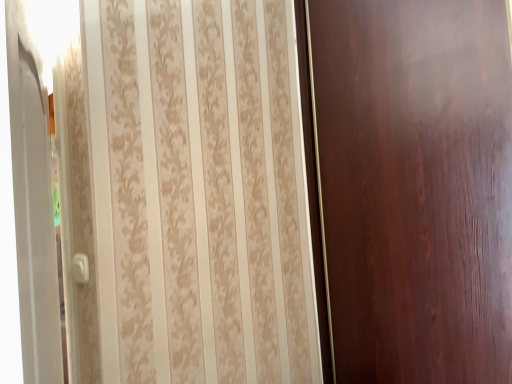
This screenshot has width=512, height=384. Find the location of `dark wood door at right`. dark wood door at right is located at coordinates (415, 187).

What do you see at coordinates (415, 187) in the screenshot?
I see `dark wood door at right` at bounding box center [415, 187].

The height and width of the screenshot is (384, 512). I want to click on dark wood door at right, so click(415, 187).